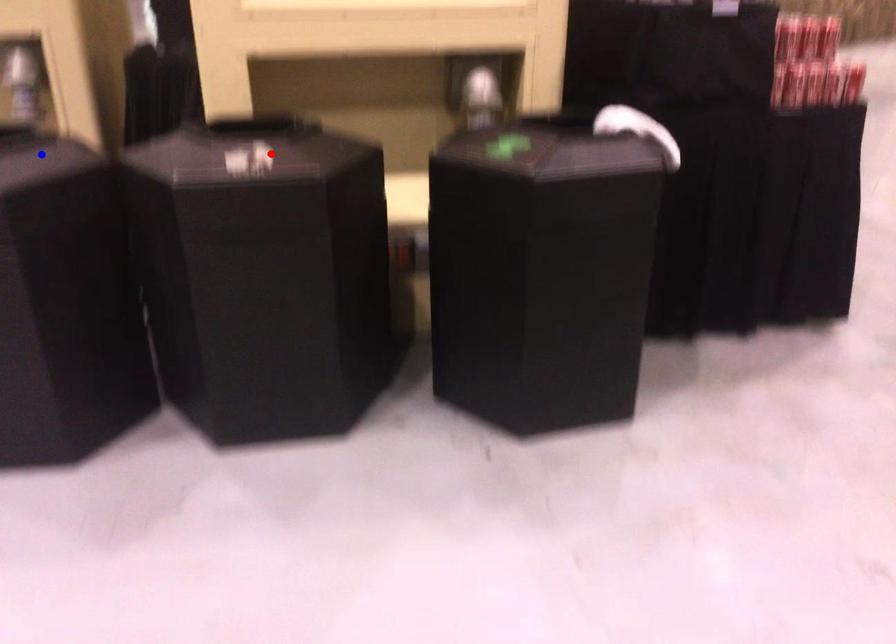
Question: In the image, two points are highlighted. Which point is nearer to the camera? Reply with the corresponding letter.

Choices:
 (A) blue point
 (B) red point

Answer: (B)